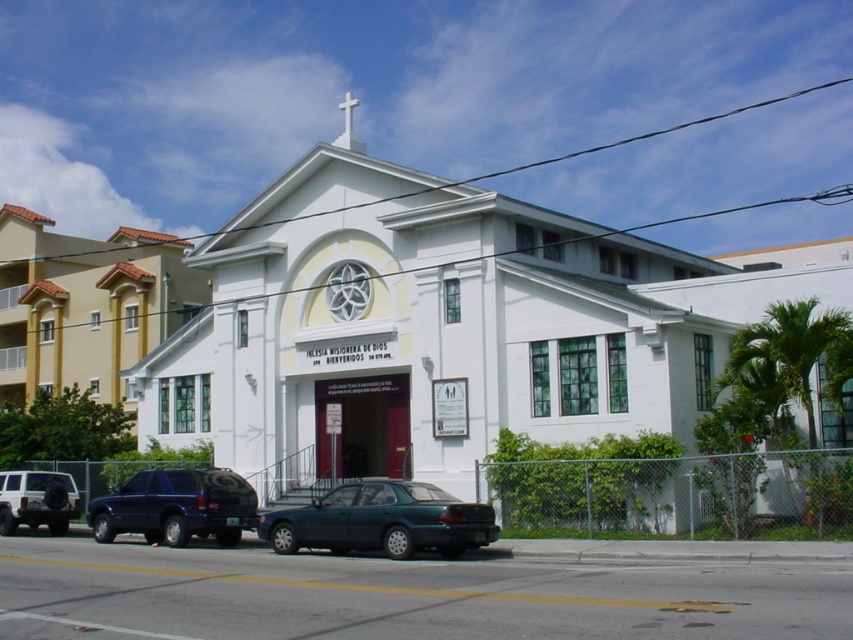
Question: Is teal glossy sedan at center to the left of metallic blue suv at lower left from the viewer's perspective?

Choices:
 (A) yes
 (B) no

Answer: (B)

Question: Estimate the real-world distances between objects in this image. Which object is farther from the white smooth chapel at center?

Choices:
 (A) beige stucco church at center
 (B) metallic blue suv at lower left
 (C) matte black suv at lower left

Answer: (A)

Question: Considering the real-world distances, which object is closest to the beige stucco church at center?

Choices:
 (A) matte black suv at lower left
 (B) metallic blue suv at lower left
 (C) teal glossy sedan at center
 (D) white smooth chapel at center

Answer: (A)

Question: Can you confirm if white smooth chapel at center is positioned above teal glossy sedan at center?

Choices:
 (A) no
 (B) yes

Answer: (B)

Question: Can you confirm if white smooth chapel at center is bigger than metallic blue suv at lower left?

Choices:
 (A) no
 (B) yes

Answer: (B)

Question: Which point is closer to the camera taking this photo?

Choices:
 (A) (583, 232)
 (B) (447, 552)
 (C) (126, 243)

Answer: (B)